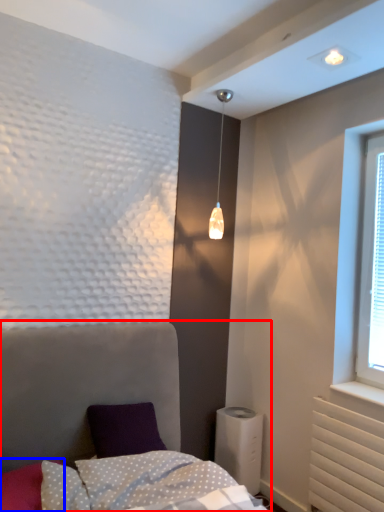
Question: Which object appears farthest to the camera in this image, bed (highlighted by a red box) or pillow (highlighted by a blue box)?

Choices:
 (A) bed
 (B) pillow

Answer: (B)